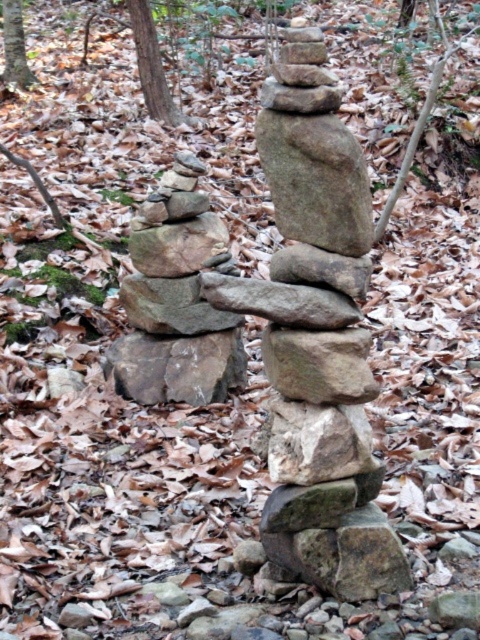
Is natural stone stack at center thinner than smooth gray rock at center?

Answer: Incorrect, natural stone stack at center's width is not less than smooth gray rock at center's.

The width and height of the screenshot is (480, 640). What do you see at coordinates (317, 339) in the screenshot?
I see `natural stone stack at center` at bounding box center [317, 339].

Locate an element on the screen. Image resolution: width=480 pixels, height=640 pixels. natural stone stack at center is located at coordinates (317, 339).

Does natural stone stack at center have a lesser height compared to rustic stone stack at left?

No.

Can you confirm if natural stone stack at center is positioned above rustic stone stack at left?

No, natural stone stack at center is not above rustic stone stack at left.

This screenshot has height=640, width=480. What are the coordinates of `natural stone stack at center` in the screenshot? It's located at (317, 339).

Can you confirm if rustic stone stack at left is positioned to the left of rough textured rock at center?

No, rustic stone stack at left is not to the left of rough textured rock at center.

Does rustic stone stack at left have a larger size compared to rough textured rock at center?

Indeed, rustic stone stack at left has a larger size compared to rough textured rock at center.

Which is in front, point (131, 236) or point (237, 385)?

Positioned in front is point (131, 236).

The image size is (480, 640). In order to click on rustic stone stack at left in this screenshot , I will do `click(176, 300)`.